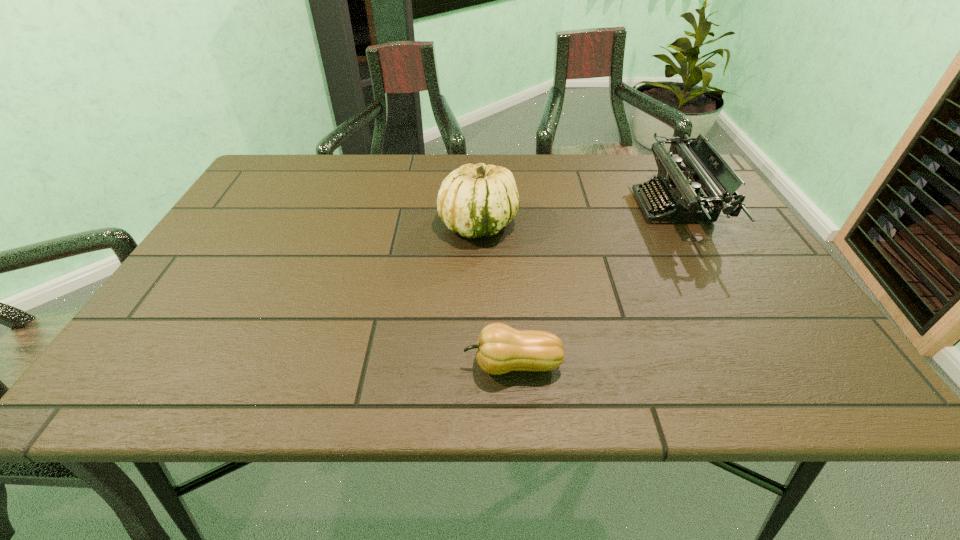
Where is `free space located 0.050m on the stem side of the nearer gourd`? free space located 0.050m on the stem side of the nearer gourd is located at coordinates (437, 364).

The height and width of the screenshot is (540, 960). Find the location of `object that is positioned at the far edge`. object that is positioned at the far edge is located at coordinates (705, 168).

This screenshot has width=960, height=540. Identify the location of object present at the near edge. (500, 349).

You are a GUI agent. You are given a task and a screenshot of the screen. Output one action in this format:
    pyautogui.click(x=<x>, y=<y>)
    Task: Click on the object at the right edge
    This screenshot has height=540, width=960.
    Given the screenshot: What is the action you would take?
    pyautogui.click(x=705, y=168)

At what (x,y) coordinates should I click in order to perform the action: click on object that is at the far right corner. Please return your answer as a coordinate pair (x, y). This screenshot has height=540, width=960. Looking at the image, I should click on (705, 168).

At what (x,y) coordinates should I click in order to perform the action: click on vacant space at the far edge. Please return your answer as a coordinate pair (x, y). This screenshot has height=540, width=960. Looking at the image, I should click on (398, 174).

Where is `free space at the near edge of the desktop`? The width and height of the screenshot is (960, 540). free space at the near edge of the desktop is located at coordinates (223, 381).

In the image, there is a desktop. Where is `blank space at the left edge`? Image resolution: width=960 pixels, height=540 pixels. blank space at the left edge is located at coordinates (246, 238).

The image size is (960, 540). In the image, there is a desktop. Identify the location of vacant space at the right edge. (733, 219).

In order to click on free point between the rightmost object and the nearest object in this screenshot , I will do `click(592, 286)`.